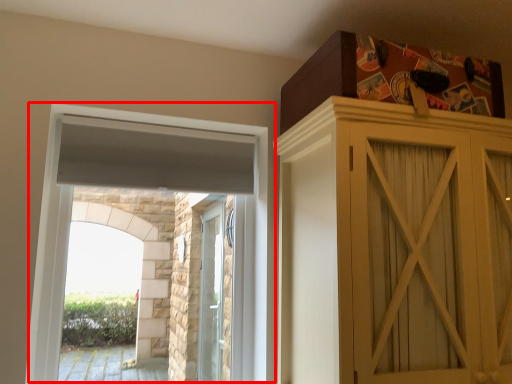
Question: Where is window (annotated by the red box) located in relation to cupboard in the image?

Choices:
 (A) left
 (B) right

Answer: (A)